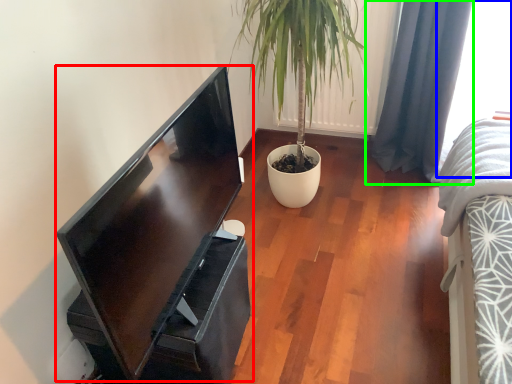
Question: Which is nearer to the computer monitor (highlighted by a red box)? window (highlighted by a blue box) or curtain (highlighted by a green box).

Choices:
 (A) window
 (B) curtain

Answer: (B)